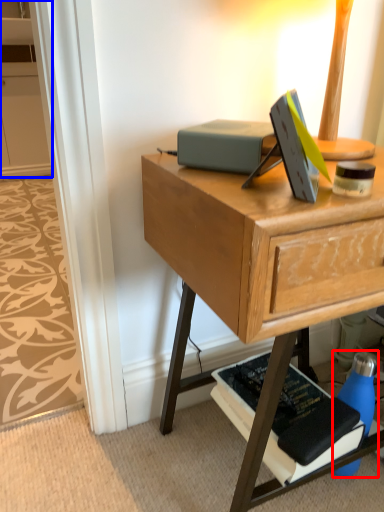
Question: Among these objects, which one is farthest to the camera, bottle (highlighted by a red box) or cabinetry (highlighted by a blue box)?

Choices:
 (A) bottle
 (B) cabinetry

Answer: (B)